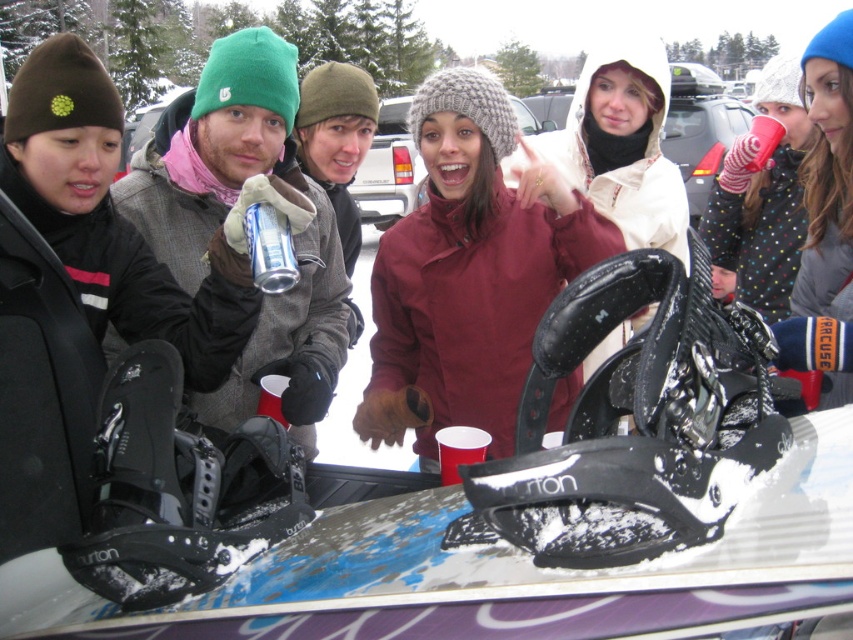
You are a photographer trying to capture a photo of the matte green beanie at left and the matte gray snowboard at center. If you want to include both in your frame, which object should you position closer to the camera to ensure both are visible?

You should position the matte green beanie at left closer to the camera because it is to the left of the matte gray snowboard at center, so moving it forward will keep both in frame.

Consider the image. You are a photographer taking a picture of the snowboard scene. You notice two points in the image at coordinates point (x=132, y=284) and point (x=289, y=273). Which point is closer to your camera?

Point (x=289, y=273) is closer to the camera because it is less further than point (x=132, y=284).